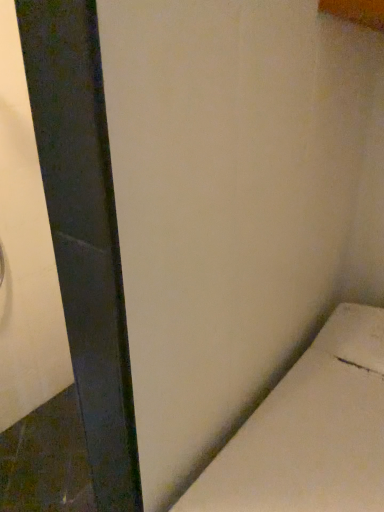
This screenshot has width=384, height=512. I want to click on white matte bench at lower right, so click(x=310, y=431).

Image resolution: width=384 pixels, height=512 pixels. What do you see at coordinates (310, 431) in the screenshot?
I see `white matte bench at lower right` at bounding box center [310, 431].

In order to face white matte bench at lower right, should I rotate leftwards or rightwards?

Rotate right and turn 14.913 degrees.

This screenshot has height=512, width=384. I want to click on white matte bench at lower right, so click(x=310, y=431).